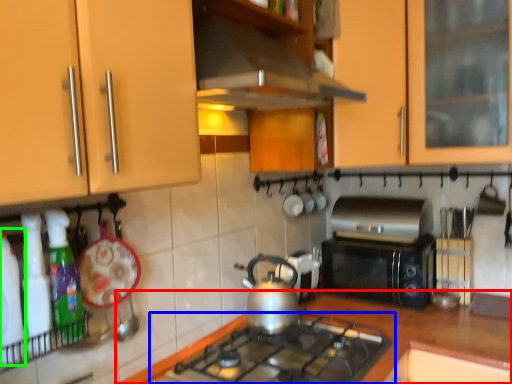
Question: Which object is positioned closest to countertop (highlighted by a red box)? Select from gas stove (highlighted by a blue box) and bottle (highlighted by a green box).

Choices:
 (A) gas stove
 (B) bottle

Answer: (A)